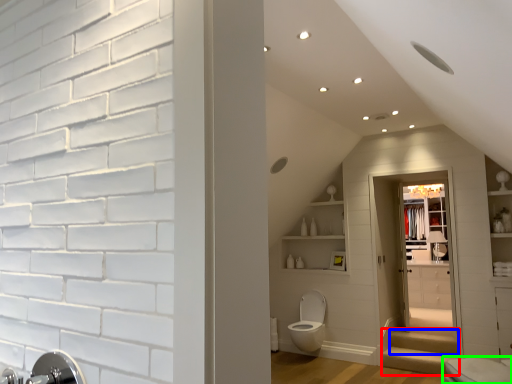
Question: Estimate the real-world distances between objects in this image. Which object is closer to stairwell (highlighted by a red box), stairwell (highlighted by a blue box) or toilet (highlighted by a green box)?

Choices:
 (A) stairwell
 (B) toilet

Answer: (A)